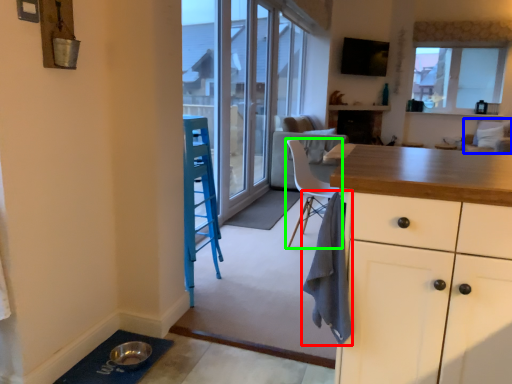
Question: Estimate the real-world distances between objects in this image. Which object is closer to cloth (highlighted by a red box), armchair (highlighted by a blue box) or chair (highlighted by a green box)?

Choices:
 (A) armchair
 (B) chair

Answer: (B)